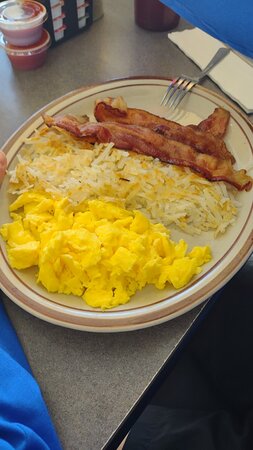
Where is `sauce container`? The image size is (253, 450). sauce container is located at coordinates (28, 33), (32, 51).